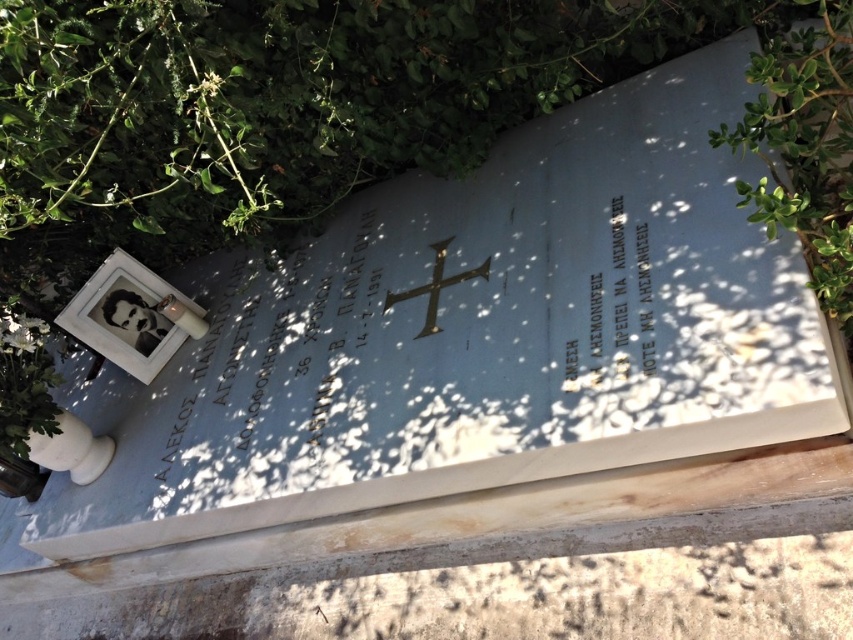
Can you confirm if green leafy bush at upper right is positioned above black paper at upper right?

Yes, green leafy bush at upper right is above black paper at upper right.

The image size is (853, 640). Describe the element at coordinates (805, 147) in the screenshot. I see `green leafy bush at upper right` at that location.

Identify the location of green leafy bush at upper right. The height and width of the screenshot is (640, 853). pos(805,147).

Can you confirm if black paper at upper right is positioned below metallic gold cross at center?

No.

Which is more to the right, black paper at upper right or metallic gold cross at center?

black paper at upper right

Measure the distance between black paper at upper right and camera.

The distance of black paper at upper right from camera is 1.74 meters.

I want to click on black paper at upper right, so click(x=624, y=296).

Can you confirm if green leafy bush at upper left is positioned below black paper at upper right?

No.

Which is behind, point (184, 104) or point (618, 282)?

The point (184, 104) is behind.

Locate an element on the screen. green leafy bush at upper left is located at coordinates (280, 108).